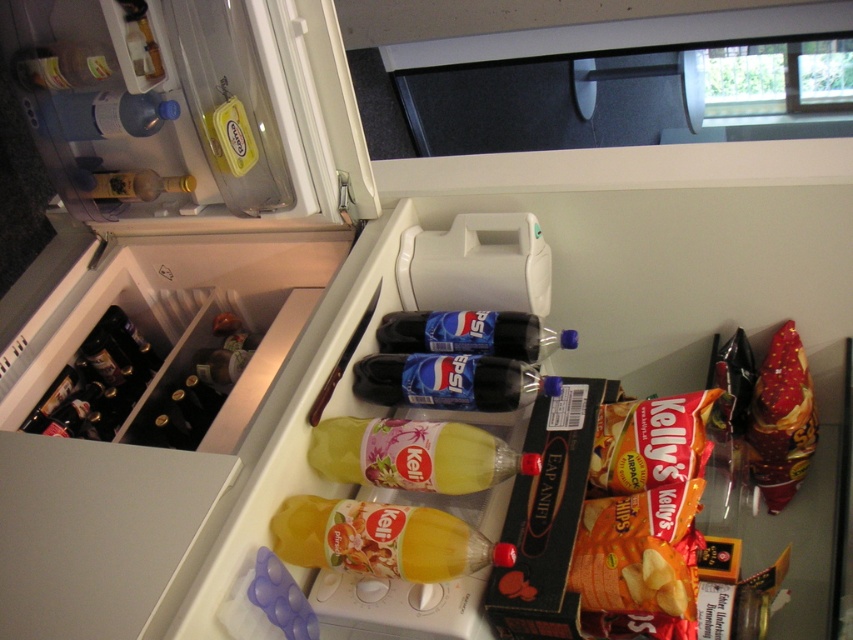
You are trying to fit a new bottle of juice into the refrigerator. You have a new bottle that is 10 cm tall. Looking at the matte plastic bottle at upper left and the matte yellow bottle at upper left, which one is taller and can accommodate your new juice bottle?

The matte plastic bottle at upper left is taller than the matte yellow bottle at upper left, so it can accommodate the new juice bottle of 10 cm height.

You are trying to reach for the shiny red plastic bag of chips at right while holding a large plate in your left hand. Can you grab the matte plastic bottle at upper left with your right hand without letting go of the plate?

The shiny red plastic bag of chips at right and matte plastic bottle at upper left are 3.31 feet apart from each other. Since the distance between them is more than an arm length, you can grab the matte plastic bottle at upper left with your right hand while holding the plate in your left without any issue.

You are organizing the contents of the refrigerator and need to place a new bottle of Pepsi. The existing Pepsi bottles are located at point (102, 115). Where should you place the new bottle to maintain symmetry with the existing ones?

Place the new bottle at point 0.820, 0.120 to mirror the existing Pepsi bottle at point (102, 115), creating symmetry along the horizontal axis.